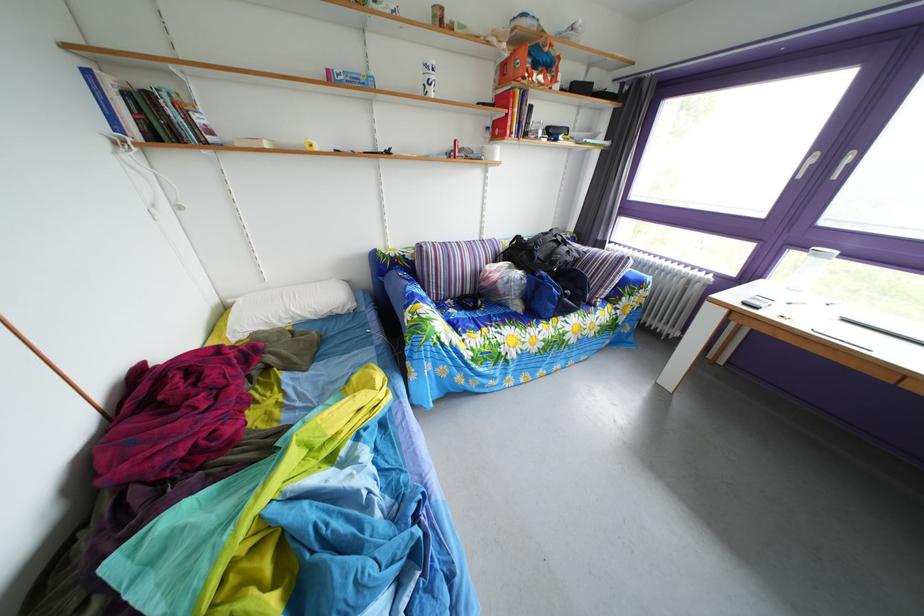
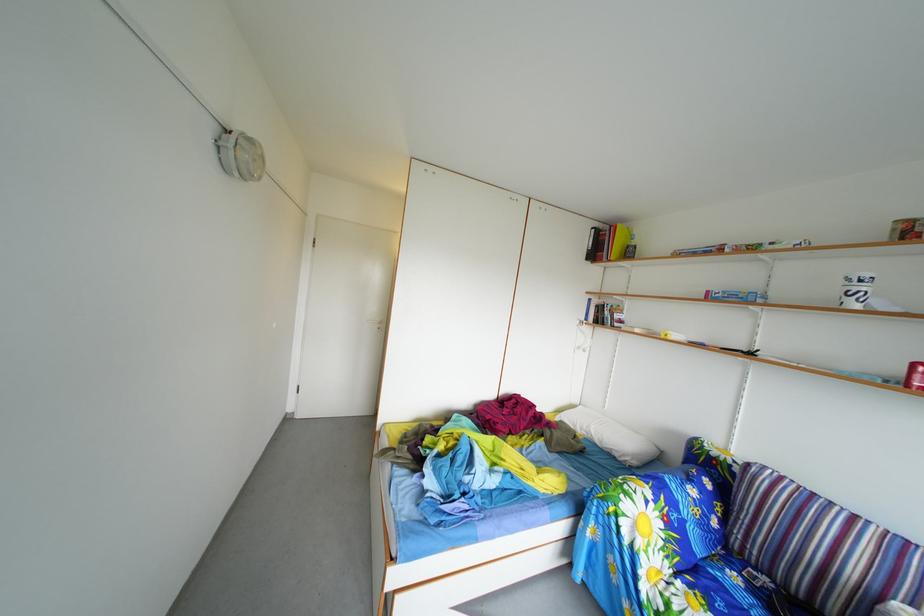
In the second image, find the point that corresponds to (x=463, y=320) in the first image.

(746, 585)